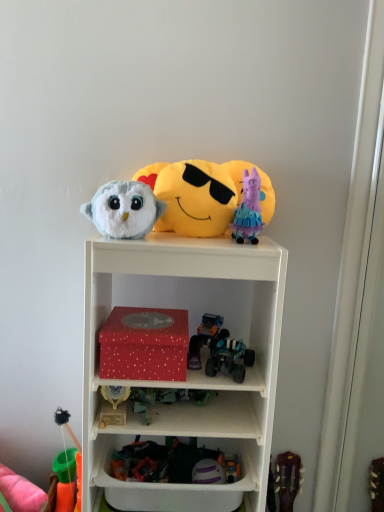
Question: Visually, is matte red box at center positioned to the left or to the right of teal plastic toy car at center, which is the fifth toy in top-to-bottom order?

Choices:
 (A) right
 (B) left

Answer: (B)

Question: Is point (276, 295) positioned closer to the camera than point (251, 365)?

Choices:
 (A) closer
 (B) farther

Answer: (A)

Question: Estimate the real-world distances between objects in this image. Which object is farther from the metallic green toy car at center, acting as the 4th toy starting from the bottom?

Choices:
 (A) soft plush toy at lower left, the 7th toy viewed from the top
 (B) purple matte helmet at lower center, the second toy ordered from the bottom
 (C) shiny metallic truck at center, the sixth toy from the bottom
 (D) teal plastic toy car at center, which is the fifth toy in top-to-bottom order
 (E) orange fabric toy at lower left, the 9th toy in the top-to-bottom sequence

Answer: (E)

Question: Considering the real-world distances, which object is closest to the yellow plush at upper center, the 2th toy viewed from the top?

Choices:
 (A) orange fabric toy at lower left, the 1th toy in the bottom-to-top sequence
 (B) matte red box at center
 (C) shiny metallic truck at center, the sixth toy from the bottom
 (D) fluffy white owl at upper center, arranged as the 3th toy when viewed from the top
 (E) soft plush toy at lower left, the 7th toy viewed from the top

Answer: (D)